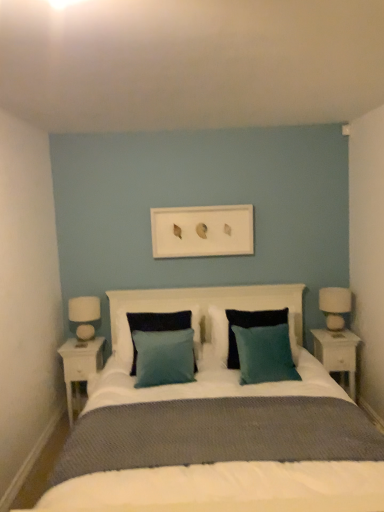
Find the location of a particular element. free space above white glossy nightstand at right, placed as the second nightstand when sorted from left to right (from a real-world perspective) is located at coordinates (330, 333).